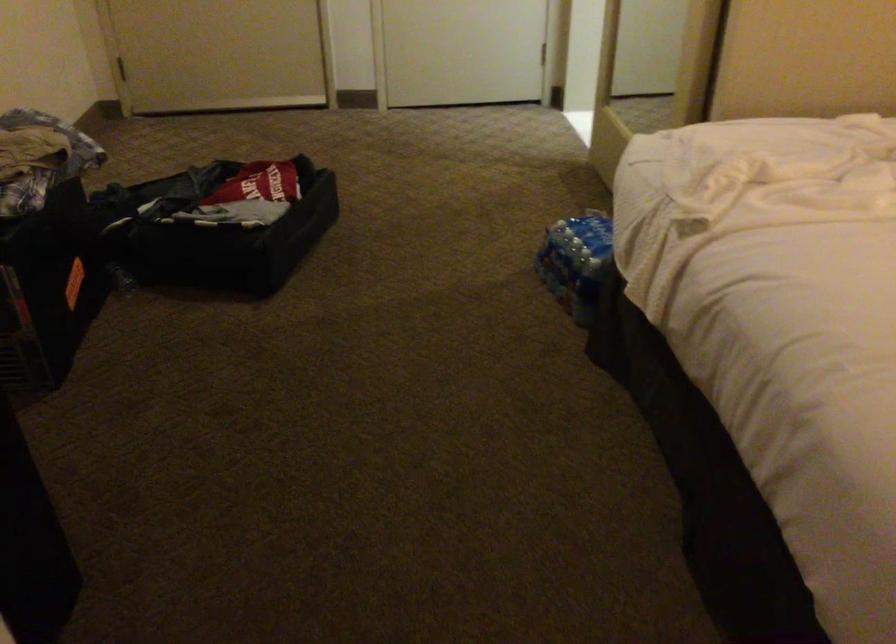
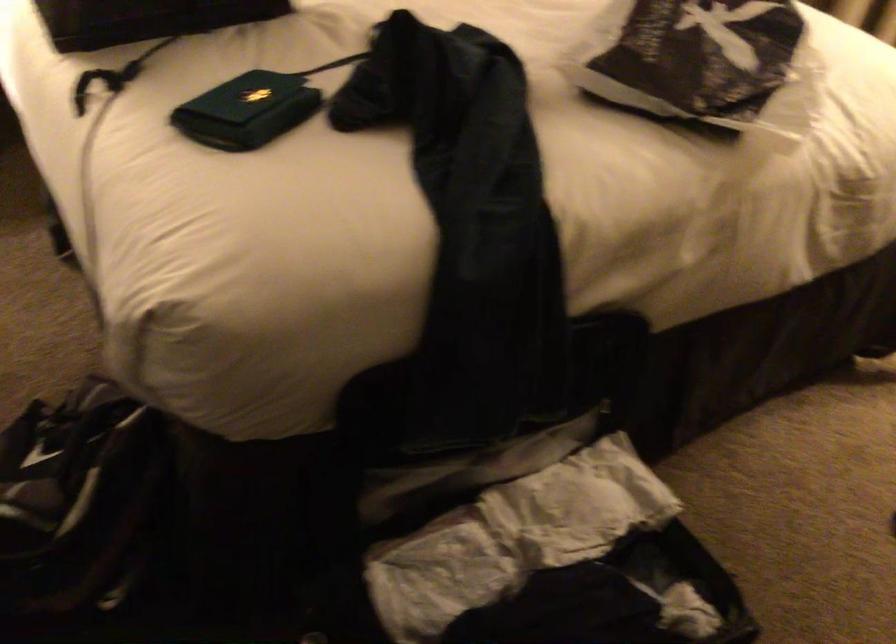
First-person continuous shooting, in which direction is the camera rotating?

The camera rotated toward right-down.